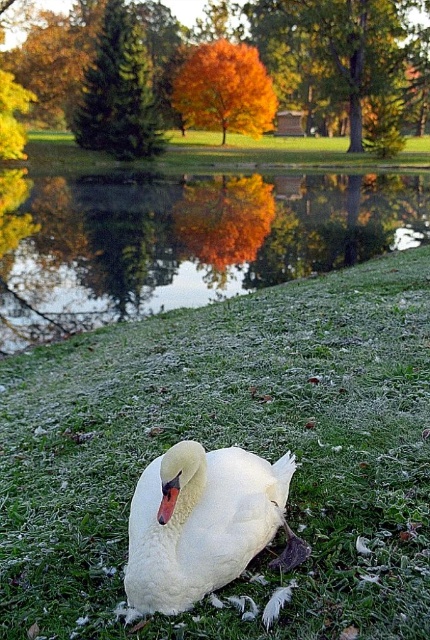
Describe the element at coordinates (184, 241) in the screenshot. I see `glossy reflective water at center` at that location.

From the picture: Which of these two, glossy reflective water at center or white feathered swan at center, stands shorter?

With less height is white feathered swan at center.

Is point (61, 269) closer to camera compared to point (162, 461)?

No, (61, 269) is further to viewer.

At what (x,y) coordinates should I click in order to perform the action: click on glossy reflective water at center. Please return your answer as a coordinate pair (x, y). Looking at the image, I should click on (184, 241).

Looking at this image, can you confirm if white fluffy grass at lower center is positioned to the left of white feathered swan at center?

In fact, white fluffy grass at lower center is to the right of white feathered swan at center.

Does white fluffy grass at lower center have a larger size compared to white feathered swan at center?

Yes, white fluffy grass at lower center is bigger than white feathered swan at center.

Is point (205, 422) less distant than point (183, 467)?

No, it is not.

Identify the location of white fluffy grass at lower center. (230, 444).

Is white fluffy grass at lower center below glossy reflective water at center?

Correct, white fluffy grass at lower center is located below glossy reflective water at center.

Does white fluffy grass at lower center have a lesser width compared to glossy reflective water at center?

Yes, white fluffy grass at lower center is thinner than glossy reflective water at center.

Which is in front, point (12, 621) or point (235, 291)?

Positioned in front is point (12, 621).

The height and width of the screenshot is (640, 430). I want to click on white fluffy grass at lower center, so click(230, 444).